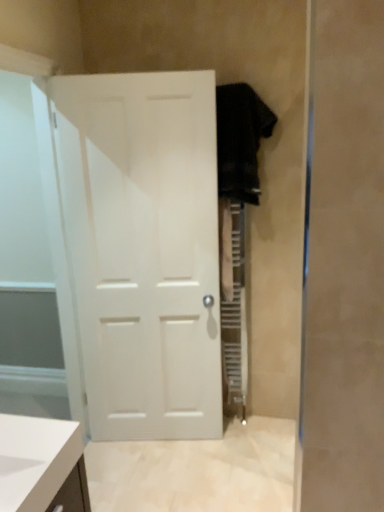
Identify the location of white matte door at center. The height and width of the screenshot is (512, 384). (143, 249).

Between black fabric robe at right and white matte door at center, which one is positioned in front?

white matte door at center is more forward.

You are a GUI agent. You are given a task and a screenshot of the screen. Output one action in this format:
    pyautogui.click(x=<x>, y=<y>)
    Task: Click on the robe behind the white matte door at center
    This screenshot has height=512, width=384.
    Given the screenshot: What is the action you would take?
    pyautogui.click(x=240, y=140)

Is black fabric robe at right located outside white matte door at center?

Yes, black fabric robe at right is located beyond the bounds of white matte door at center.

Is black fabric robe at right bigger than white matte door at center?

No, black fabric robe at right is not bigger than white matte door at center.

Is white matte door at center next to transparent glass door at left and touching it?

No, white matte door at center is not in contact with transparent glass door at left.

How far apart are white matte door at center and transparent glass door at left?

white matte door at center is 17.78 inches from transparent glass door at left.

Considering the positions of point (92, 168) and point (85, 407), is point (92, 168) closer or farther from the camera than point (85, 407)?

Point (92, 168) appears to be closer to the viewer than point (85, 407).

From the image's perspective, is white matte door at center located above black fabric robe at right?

No, from the image's perspective, white matte door at center is not above black fabric robe at right.

This screenshot has height=512, width=384. Identify the location of robe that is above the white matte door at center (from a real-world perspective). (240, 140).

From the picture: Which is more to the right, white matte door at center or black fabric robe at right?

From the viewer's perspective, black fabric robe at right appears more on the right side.

Between transparent glass door at left and white matte door at center, which one has more height?

transparent glass door at left.

Is transparent glass door at left inside or outside of white matte door at center?

transparent glass door at left is spatially situated outside white matte door at center.

How distant is transparent glass door at left from white matte door at center?

transparent glass door at left and white matte door at center are 17.78 inches apart from each other.

Is white matte door at center at the back of transparent glass door at left?

No.

From a real-world perspective, between black fabric robe at right and transparent glass door at left, who is vertically higher?

black fabric robe at right is physically above.

Is black fabric robe at right turned away from transparent glass door at left?

No, black fabric robe at right's orientation is not away from transparent glass door at left.

Is the position of black fabric robe at right more distant than that of transparent glass door at left?

Yes, it is behind transparent glass door at left.

From the image's perspective, between black fabric robe at right and transparent glass door at left, which one is located above?

black fabric robe at right.

Looking at this image, measure the distance between transparent glass door at left and black fabric robe at right.

The distance of transparent glass door at left from black fabric robe at right is 1.15 meters.

Between transparent glass door at left and black fabric robe at right, which one has more height?

transparent glass door at left.

Is transparent glass door at left not close to black fabric robe at right?

transparent glass door at left is positioned a significant distance from black fabric robe at right.

Where is `door below the black fabric robe at right (from the image's perspective)`? door below the black fabric robe at right (from the image's perspective) is located at coordinates (143, 249).

What are the coordinates of `door below the transparent glass door at left (from a real-world perspective)` in the screenshot? It's located at (143, 249).

Based on their spatial positions, is black fabric robe at right or transparent glass door at left closer to white matte door at center?

transparent glass door at left.

From the image, which object appears to be farther from transparent glass door at left, white matte door at center or black fabric robe at right?

Based on the image, black fabric robe at right appears to be further to transparent glass door at left.

When comparing their distances from black fabric robe at right, does white matte door at center or transparent glass door at left seem closer?

Among the two, white matte door at center is located nearer to black fabric robe at right.

Consider the image. Based on their spatial positions, is transparent glass door at left or black fabric robe at right further from white matte door at center?

Among the two, black fabric robe at right is located further to white matte door at center.

When comparing their distances from black fabric robe at right, does transparent glass door at left or white matte door at center seem further?

Based on the image, transparent glass door at left appears to be further to black fabric robe at right.

In the scene shown: Looking at the image, which one is located further to transparent glass door at left, black fabric robe at right or white matte door at center?

black fabric robe at right.

Where is `door located between transparent glass door at left and black fabric robe at right in the left-right direction`? door located between transparent glass door at left and black fabric robe at right in the left-right direction is located at coordinates (143, 249).